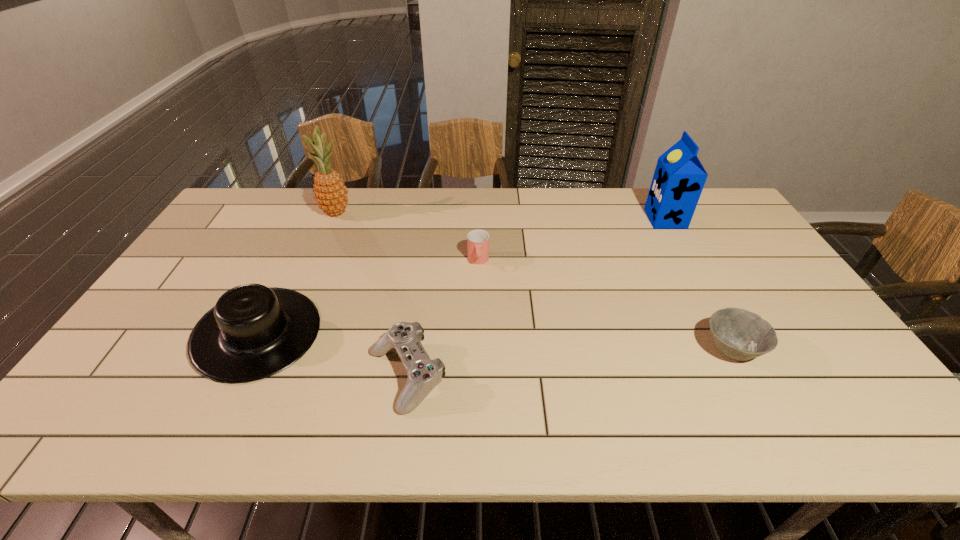
This screenshot has height=540, width=960. What are the coordinates of `unoccupied area between the pineapple and the cup` in the screenshot? It's located at (407, 237).

Locate an element on the screen. The height and width of the screenshot is (540, 960). the third closest object relative to the bowl is located at coordinates (424, 374).

Identify which object is the closest to the control. Please provide its 2D coordinates. Your answer should be formatted as a tuple, i.e. [(x, y)], where the tuple contains the x and y coordinates of a point satisfying the conditions above.

[(253, 332)]

Where is `vacant space that satisfies the following two spatial constraints: 1. on the front side of the dress hat; 2. on the right side of the bowl`? The height and width of the screenshot is (540, 960). vacant space that satisfies the following two spatial constraints: 1. on the front side of the dress hat; 2. on the right side of the bowl is located at coordinates (251, 349).

In order to click on free space in the image that satisfies the following two spatial constraints: 1. on the back side of the bowl; 2. on the left side of the control in this screenshot , I will do (411, 349).

In order to click on free space that satisfies the following two spatial constraints: 1. on the side of the cup with the handle; 2. on the left side of the bowl in this screenshot , I will do `click(478, 349)`.

The width and height of the screenshot is (960, 540). Find the location of `free space that satisfies the following two spatial constraints: 1. on the side of the bowl with the handle; 2. on the left side of the cup`. free space that satisfies the following two spatial constraints: 1. on the side of the bowl with the handle; 2. on the left side of the cup is located at coordinates (478, 349).